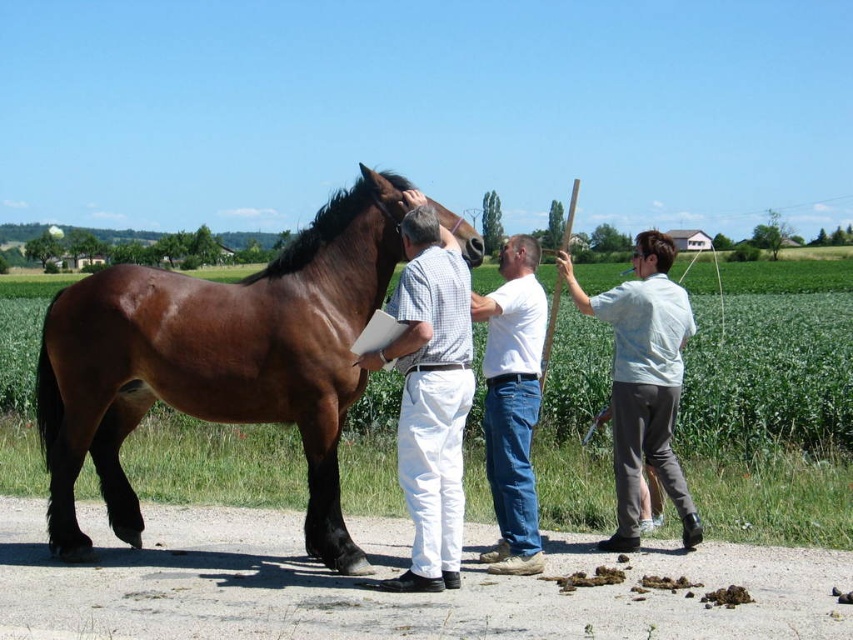
You are a photographer standing at the origin point of the image coordinate system. You want to take a photo of the brown glossy horse at center. Where should you position your camera to capture the horse in the frame?

The brown glossy horse at center is located at point (219,362) in the 2D coordinate system. To capture the horse in the frame, position your camera at the origin point facing towards the coordinates (219,362).

Based on the photo, you are standing in the rural outdoor scene depicted. You notice a specific point marked at coordinates point [389,310]. If you want to reach this point as quickly as possible, which direction should you move in relation to the brown horse?

The point [389,310] is 17.80 feet away from the viewer, so you should move towards the direction facing the brown horse to reach it quickly.

You are a photographer standing behind the brown horse and want to capture a clear photo of both the white cotton pants at center and the light blue shirt at right. Can you see both of them fully without any obstruction?

The white cotton pants at center is in front of the light blue shirt at right, so the light blue shirt at right might be partially obscured by the white cotton pants at center. Therefore, you might not be able to see both fully without any obstruction.